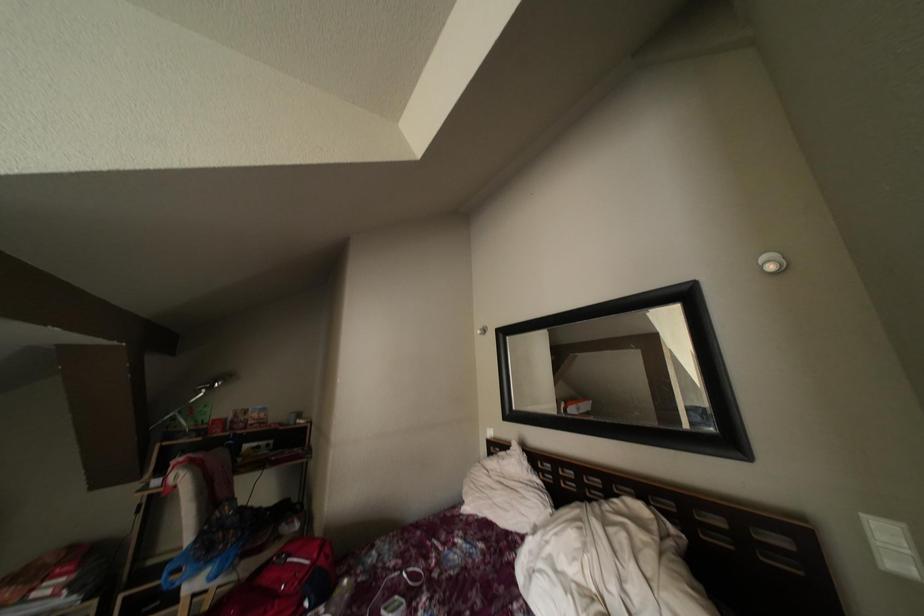
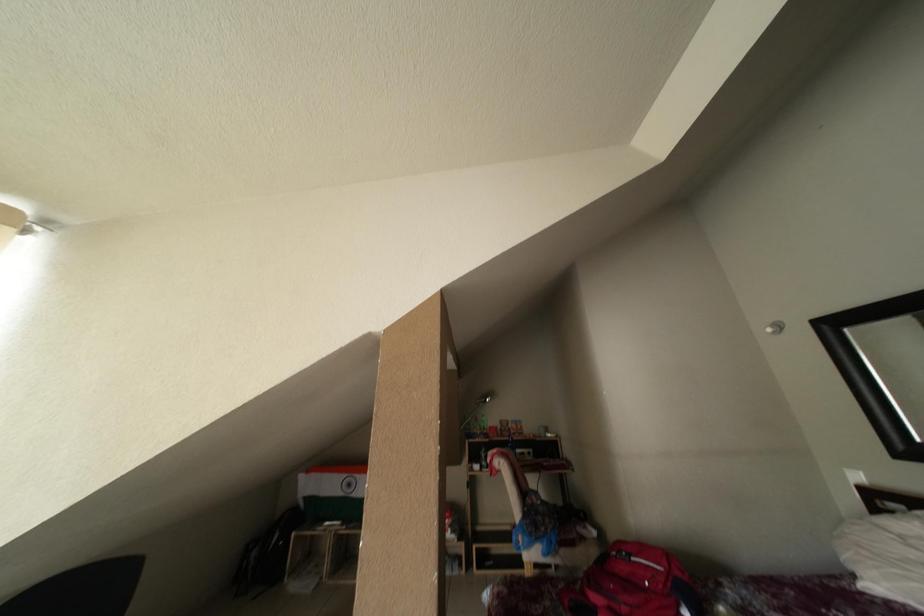
Question: The camera is either moving clockwise (left) or counter-clockwise (right) around the object. The first image is from the beginning of the video and the second image is from the end. Is the camera moving left or right when shooting the video?

Choices:
 (A) Left
 (B) Right

Answer: (B)